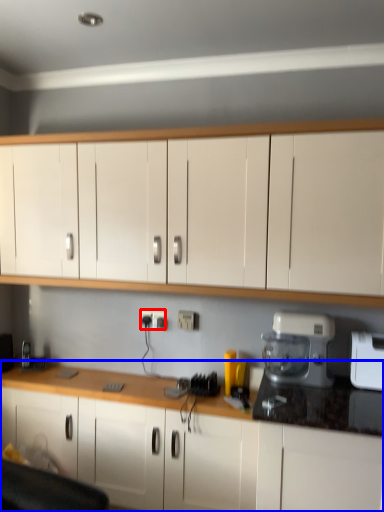
Question: Among these objects, which one is farthest to the camera, electric outlet (highlighted by a red box) or cabinetry (highlighted by a blue box)?

Choices:
 (A) electric outlet
 (B) cabinetry

Answer: (A)